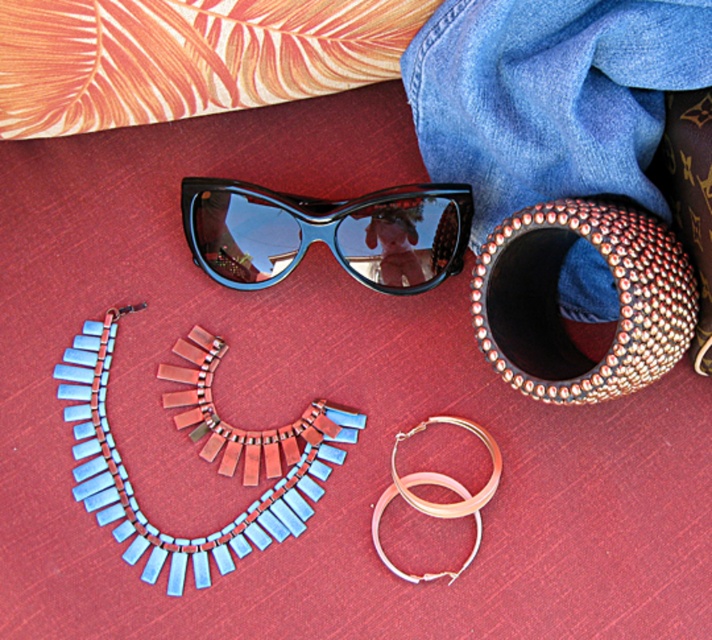
Question: Is blue plastic necklace at center to the left of gold metallic hoop earrings at upper center from the viewer's perspective?

Choices:
 (A) yes
 (B) no

Answer: (A)

Question: Which object is closer to the camera taking this photo?

Choices:
 (A) studded leather bracelet at upper right
 (B) blue plastic necklace at center
 (C) black glossy sunglasses at upper center
 (D) gold metallic hoop earrings at upper center

Answer: (A)

Question: Which point is farther to the camera?

Choices:
 (A) (375, 548)
 (B) (387, 289)
 (C) (251, 472)
 (D) (639, 381)

Answer: (B)

Question: Based on their relative distances, which object is farther from the gold metallic hoop earrings at upper center?

Choices:
 (A) studded leather bracelet at upper right
 (B) blue plastic necklace at center
 (C) black glossy sunglasses at upper center

Answer: (C)

Question: Can you confirm if blue plastic necklace at center is positioned to the right of black glossy sunglasses at upper center?

Choices:
 (A) no
 (B) yes

Answer: (A)

Question: Is blue plastic necklace at center behind black glossy sunglasses at upper center?

Choices:
 (A) no
 (B) yes

Answer: (A)